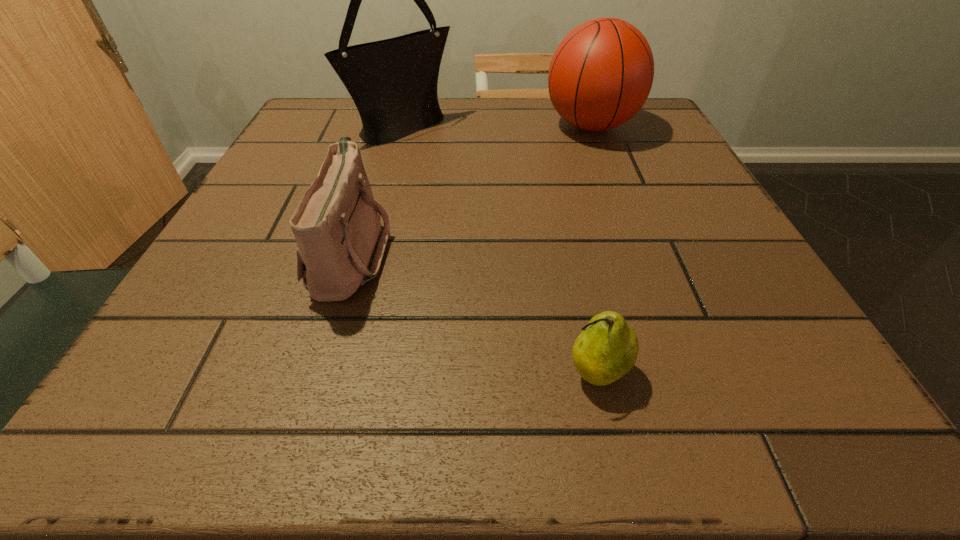
At what (x,y) coordinates should I click in order to perform the action: click on blank space located 0.080m on the left of the pear. Please return your answer as a coordinate pair (x, y). This screenshot has width=960, height=540. Looking at the image, I should click on (501, 372).

Locate an element on the screen. This screenshot has height=540, width=960. shoulder bag at the far edge is located at coordinates (393, 82).

Locate an element on the screen. Image resolution: width=960 pixels, height=540 pixels. basketball at the far edge is located at coordinates (601, 74).

The width and height of the screenshot is (960, 540). I want to click on object that is positioned at the near edge, so click(607, 349).

Where is `object that is at the right edge`? object that is at the right edge is located at coordinates (601, 74).

Identify the location of object situated at the far left corner. This screenshot has height=540, width=960. (393, 82).

I want to click on object positioned at the far right corner, so click(x=601, y=74).

Image resolution: width=960 pixels, height=540 pixels. Identify the location of vacant space at the far edge of the desktop. (496, 120).

In the image, there is a desktop. At what (x,y) coordinates should I click in order to perform the action: click on blank space at the near edge. Please return your answer as a coordinate pair (x, y). This screenshot has height=540, width=960. Looking at the image, I should click on (372, 372).

Identify the location of free location at the left edge of the desktop. pos(223,337).